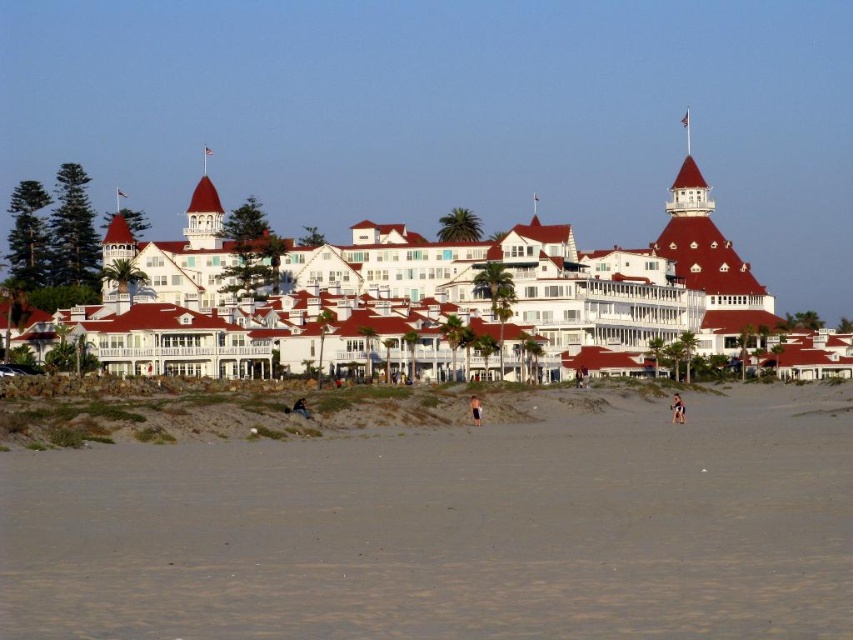
Is point (728, 568) positioned behind point (646, 260)?

No, (728, 568) is closer to viewer.

From the picture: Can you confirm if gray sand at lower center is shorter than white wood resort at center?

Yes, gray sand at lower center is shorter than white wood resort at center.

Is point (129, 573) in front of point (521, 294)?

Yes, point (129, 573) is in front of point (521, 294).

The image size is (853, 640). Find the location of `gray sand at lower center`. gray sand at lower center is located at coordinates [x=450, y=531].

This screenshot has width=853, height=640. Describe the element at coordinates (450, 531) in the screenshot. I see `gray sand at lower center` at that location.

Locate an element on the screen. This screenshot has width=853, height=640. gray sand at lower center is located at coordinates (450, 531).

Does reddish-orange fabric shorts at lower right have a greater width compared to tan skin person at center?

Yes, reddish-orange fabric shorts at lower right is wider than tan skin person at center.

Does reddish-orange fabric shorts at lower right have a lesser width compared to tan skin person at center?

No, reddish-orange fabric shorts at lower right is not thinner than tan skin person at center.

Locate an element on the screen. This screenshot has width=853, height=640. reddish-orange fabric shorts at lower right is located at coordinates (677, 408).

Find the location of a particular element. The height and width of the screenshot is (640, 853). reddish-orange fabric shorts at lower right is located at coordinates click(677, 408).